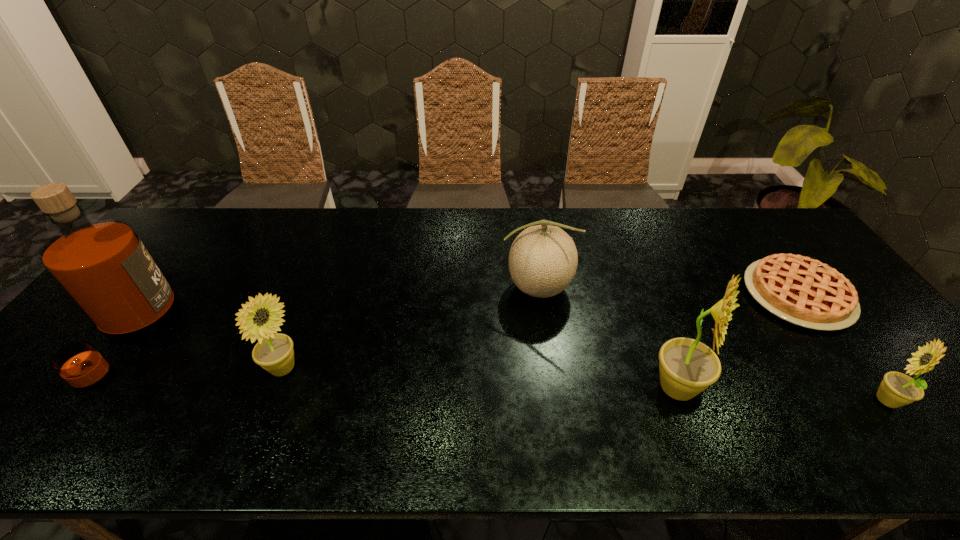
Where is `free space located 0.100m on the face of the third object from right to left`? The height and width of the screenshot is (540, 960). free space located 0.100m on the face of the third object from right to left is located at coordinates (748, 389).

Where is `blank space located on the face of the fifth tallest object`? This screenshot has width=960, height=540. blank space located on the face of the fifth tallest object is located at coordinates (753, 400).

Find the location of a particular element. This screenshot has width=960, height=540. vacant position located on the face of the fifth tallest object is located at coordinates (839, 400).

Locate an element on the screen. vacant region located on the face of the fifth tallest object is located at coordinates (817, 400).

Locate an element on the screen. The height and width of the screenshot is (540, 960). vacant region located 0.320m on the front label of the liquor is located at coordinates (288, 339).

I want to click on blank space located on the front of the third object from left to right, so click(x=543, y=340).

Find the location of a particular element. The width and height of the screenshot is (960, 540). vacant space located 0.240m on the left of the pie is located at coordinates (663, 295).

Find the location of a particular element. The width and height of the screenshot is (960, 540). liquor positioned at the near edge is located at coordinates (103, 266).

Image resolution: width=960 pixels, height=540 pixels. What are the coordinates of `object at the left edge` in the screenshot? It's located at (103, 266).

Where is `sunflower at the right edge`? The image size is (960, 540). sunflower at the right edge is located at coordinates (897, 389).